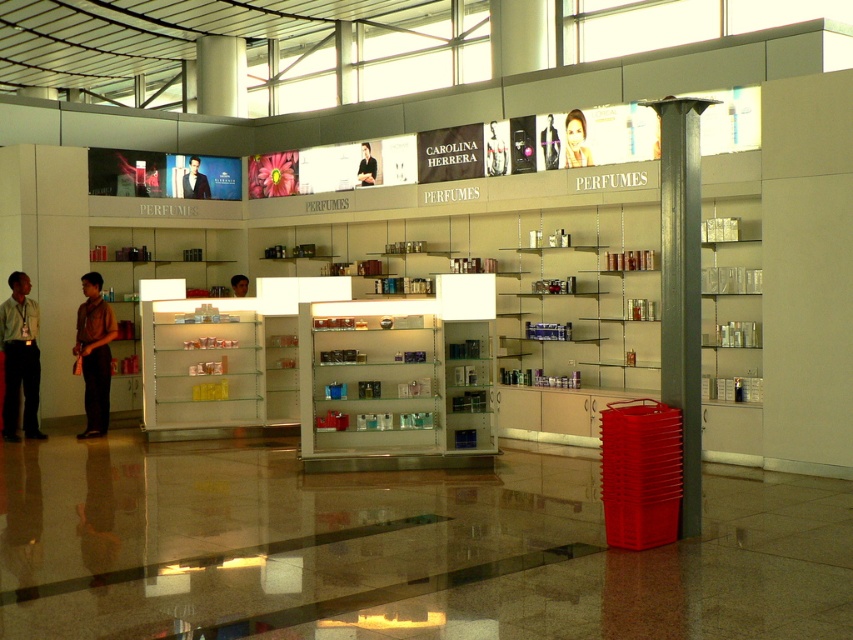
Does matte black shirt at left appear on the right side of matte black mannequin at center?

No, matte black shirt at left is not to the right of matte black mannequin at center.

Who is more forward, [28,339] or [364,148]?

Point [28,339]

Find the location of a particular element. This screenshot has width=853, height=640. matte black shirt at left is located at coordinates tap(20, 356).

Is brown shirt at center closer to the viewer compared to matte black perfume at upper center?

Yes.

Does point (103, 365) come farther from viewer compared to point (494, 154)?

No, (103, 365) is in front of (494, 154).

Where is `brown shirt at center`? This screenshot has height=640, width=853. brown shirt at center is located at coordinates 94,353.

Between point (668, 372) and point (556, 157), which one is positioned behind?

Point (556, 157)

Who is positioned more to the right, metallic gray pole at center or matte black jacket at upper center?

Positioned to the right is metallic gray pole at center.

Identify the location of metallic gray pole at center. This screenshot has width=853, height=640. (682, 288).